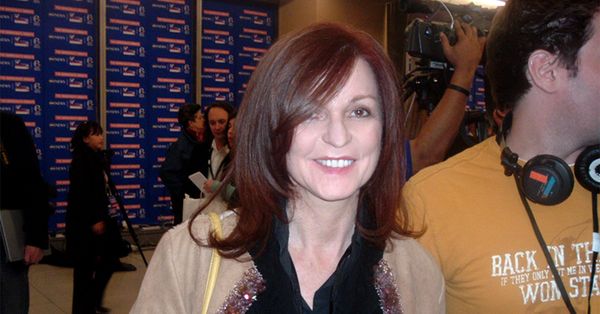
Find the location of a particular element. floor is located at coordinates (116, 297).